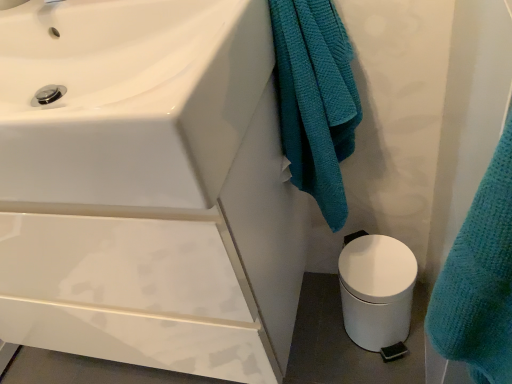
Describe the element at coordinates (129, 99) in the screenshot. I see `white glossy sink at upper left` at that location.

What do you see at coordinates (315, 99) in the screenshot? This screenshot has height=384, width=512. I see `teal textured towel at center` at bounding box center [315, 99].

The image size is (512, 384). What do you see at coordinates (376, 290) in the screenshot?
I see `white matte trash can at lower right` at bounding box center [376, 290].

Where is `white glossy sink at upper left`? white glossy sink at upper left is located at coordinates (129, 99).

Which of these two, white glossy sink at upper left or white matte trash can at lower right, stands taller?

white matte trash can at lower right is taller.

From the image's perspective, which is above, white glossy sink at upper left or white matte trash can at lower right?

white glossy sink at upper left is shown above in the image.

Relative to white matte trash can at lower right, is white glossy sink at upper left in front or behind?

white glossy sink at upper left is positioned closer to the viewer than white matte trash can at lower right.

Is white matte trash can at lower right outside of teal textured towel at center?

white matte trash can at lower right is positioned outside teal textured towel at center.

In terms of size, does white matte trash can at lower right appear bigger or smaller than teal textured towel at center?

white matte trash can at lower right is smaller than teal textured towel at center.

Is white matte trash can at lower right not inside white glossy sink at upper left?

white matte trash can at lower right lies outside white glossy sink at upper left's area.

Considering the relative positions of white matte trash can at lower right and white glossy sink at upper left in the image provided, is white matte trash can at lower right to the right of white glossy sink at upper left from the viewer's perspective?

Yes.

Considering the sizes of objects white matte trash can at lower right and white glossy sink at upper left in the image provided, who is smaller, white matte trash can at lower right or white glossy sink at upper left?

Smaller between the two is white matte trash can at lower right.

In terms of width, does white matte trash can at lower right look wider or thinner when compared to white glossy sink at upper left?

Clearly, white matte trash can at lower right has less width compared to white glossy sink at upper left.

Which object is further away from the camera, teal textured towel at center or white glossy sink at upper left?

Positioned behind is teal textured towel at center.

From the image's perspective, who appears lower, teal textured towel at center or white glossy sink at upper left?

teal textured towel at center is shown below in the image.

Can you confirm if teal textured towel at center is smaller than white glossy sink at upper left?

Correct, teal textured towel at center occupies less space than white glossy sink at upper left.

Would you say teal textured towel at center is to the left or to the right of white matte trash can at lower right in the picture?

From the image, it's evident that teal textured towel at center is to the left of white matte trash can at lower right.

Between teal textured towel at center and white matte trash can at lower right, which one has larger size?

teal textured towel at center is bigger.

Is white glossy sink at upper left positioned in front of teal textured towel at center?

Yes, white glossy sink at upper left is in front of teal textured towel at center.

Is there a large distance between white glossy sink at upper left and teal textured towel at center?

Actually, white glossy sink at upper left and teal textured towel at center are a little close together.

Is white glossy sink at upper left shorter than teal textured towel at center?

Indeed, white glossy sink at upper left has a lesser height compared to teal textured towel at center.

How many degrees apart are the facing directions of white glossy sink at upper left and teal textured towel at center?

The angle between the facing direction of white glossy sink at upper left and the facing direction of teal textured towel at center is 6.51e-05 degrees.

At what (x,y) coordinates should I click in order to perform the action: click on toilet bowl on the right of the white glossy sink at upper left. Please return your answer as a coordinate pair (x, y). The image size is (512, 384). Looking at the image, I should click on (376, 290).

Identify the location of bath towel above the white matte trash can at lower right (from the image's perspective). (315, 99).

From the image, which object appears to be nearer to white glossy sink at upper left, white matte trash can at lower right or teal textured towel at center?

Based on the image, teal textured towel at center appears to be nearer to white glossy sink at upper left.

Estimate the real-world distances between objects in this image. Which object is closer to white matte trash can at lower right, white glossy sink at upper left or teal textured towel at center?

Based on the image, teal textured towel at center appears to be nearer to white matte trash can at lower right.

Consider the image. Estimate the real-world distances between objects in this image. Which object is closer to teal textured towel at center, white matte trash can at lower right or white glossy sink at upper left?

Based on the image, white glossy sink at upper left appears to be nearer to teal textured towel at center.

When comparing their distances from white glossy sink at upper left, does teal textured towel at center or white matte trash can at lower right seem closer?

Among the two, teal textured towel at center is located nearer to white glossy sink at upper left.

Estimate the real-world distances between objects in this image. Which object is closer to white matte trash can at lower right, teal textured towel at center or white glossy sink at upper left?

Among the two, teal textured towel at center is located nearer to white matte trash can at lower right.

From the image, which object appears to be nearer to teal textured towel at center, white glossy sink at upper left or white matte trash can at lower right?

Among the two, white glossy sink at upper left is located nearer to teal textured towel at center.

You are a GUI agent. You are given a task and a screenshot of the screen. Output one action in this format:
    pyautogui.click(x=<x>, y=<y>)
    Task: Click on the bath towel between white glossy sink at upper left and white matte trash can at lower right in the horizontal direction
    This screenshot has width=512, height=384.
    Given the screenshot: What is the action you would take?
    pyautogui.click(x=315, y=99)